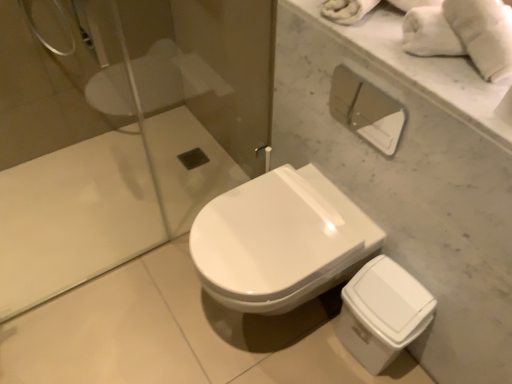
The image size is (512, 384). What do you see at coordinates (366, 110) in the screenshot?
I see `white matte toilet paper at upper right` at bounding box center [366, 110].

This screenshot has height=384, width=512. Describe the element at coordinates (483, 34) in the screenshot. I see `white fluffy towel at upper right` at that location.

Measure the distance between white glossy toilet at center and camera.

white glossy toilet at center is 1.10 meters away from camera.

The image size is (512, 384). Identify the location of white matte toilet paper at upper right. (366, 110).

From a real-world perspective, between white matte toilet paper at upper right and white glossy toilet at center, who is vertically higher?

In real-world perspective, white matte toilet paper at upper right is above.

Who is taller, white matte toilet paper at upper right or white glossy toilet at center?

white glossy toilet at center is taller.

Is white matte toilet paper at upper right looking in the opposite direction of white glossy toilet at center?

white matte toilet paper at upper right is not turned away from white glossy toilet at center.

In the scene shown: From the image's perspective, is white matte toilet paper at upper right on top of white glossy toilet at center?

Yes.

From the image's perspective, is white glossy toilet at center positioned above or below white fluffy towel at upper right?

From the image's perspective, white glossy toilet at center appears below white fluffy towel at upper right.

From a real-world perspective, relative to white fluffy towel at upper right, is white glossy toilet at center vertically above or below?

Clearly, from a real-world perspective, white glossy toilet at center is below white fluffy towel at upper right.

Consider the image. Does white glossy toilet at center have a larger size compared to white matte toilet paper at upper right?

Correct, white glossy toilet at center is larger in size than white matte toilet paper at upper right.

Is point (347, 217) less distant than point (339, 65)?

That is False.

Could you tell me if white glossy toilet at center is turned towards white matte toilet paper at upper right?

No, white glossy toilet at center is not oriented towards white matte toilet paper at upper right.

Is white glossy toilet at center outside of white matte toilet paper at upper right?

white glossy toilet at center is positioned outside white matte toilet paper at upper right.

Considering the sizes of objects white fluffy towel at upper right and white matte toilet paper at upper right in the image provided, who is thinner, white fluffy towel at upper right or white matte toilet paper at upper right?

Thinner between the two is white matte toilet paper at upper right.

Where is `toilet paper on the left of white fluffy towel at upper right`? toilet paper on the left of white fluffy towel at upper right is located at coordinates (366, 110).

Which is correct: white fluffy towel at upper right is inside white matte toilet paper at upper right, or outside of it?

white fluffy towel at upper right is outside white matte toilet paper at upper right.

From a real-world perspective, between white fluffy towel at upper right and white matte toilet paper at upper right, who is vertically higher?

white fluffy towel at upper right, from a real-world perspective.

Does white matte toilet paper at upper right contain white fluffy towel at upper right?

No, white matte toilet paper at upper right does not contain white fluffy towel at upper right.

From a real-world perspective, between white matte toilet paper at upper right and white fluffy towel at upper right, who is vertically higher?

white fluffy towel at upper right is physically above.

Does point (362, 86) come in front of point (500, 37)?

No, (362, 86) is behind (500, 37).

Which of these two, white fluffy towel at upper right or white glossy toilet at center, is wider?

Wider between the two is white glossy toilet at center.

Which of these two, white fluffy towel at upper right or white glossy toilet at center, stands taller?

With more height is white glossy toilet at center.

From a real-world perspective, is white fluffy towel at upper right physically above white glossy toilet at center?

Indeed, from a real-world perspective, white fluffy towel at upper right stands above white glossy toilet at center.

Can you see white fluffy towel at upper right touching white glossy toilet at center?

No, white fluffy towel at upper right is not with white glossy toilet at center.

This screenshot has width=512, height=384. In order to click on toilet paper in front of the white glossy toilet at center in this screenshot , I will do `click(366, 110)`.

Identify the location of toilet beneath the white fluffy towel at upper right (from a real-world perspective). (280, 241).

Which object lies further to the anchor point white glossy toilet at center, white matte toilet paper at upper right or white fluffy towel at upper right?

white matte toilet paper at upper right.

From the image, which object appears to be nearer to white matte toilet paper at upper right, white glossy toilet at center or white fluffy towel at upper right?

The object closer to white matte toilet paper at upper right is white glossy toilet at center.

Estimate the real-world distances between objects in this image. Which object is closer to white glossy toilet at center, white fluffy towel at upper right or white matte toilet paper at upper right?

white fluffy towel at upper right is closer to white glossy toilet at center.

Which object lies further to the anchor point white fluffy towel at upper right, white matte toilet paper at upper right or white glossy toilet at center?

Based on the image, white matte toilet paper at upper right appears to be further to white fluffy towel at upper right.

Estimate the real-world distances between objects in this image. Which object is closer to white matte toilet paper at upper right, white fluffy towel at upper right or white glossy toilet at center?

The object closer to white matte toilet paper at upper right is white glossy toilet at center.

Based on their spatial positions, is white glossy toilet at center or white matte toilet paper at upper right closer to white fluffy towel at upper right?

white glossy toilet at center is closer to white fluffy towel at upper right.

At what (x,y) coordinates should I click in order to perform the action: click on toilet paper that lies between white fluffy towel at upper right and white glossy toilet at center from top to bottom. Please return your answer as a coordinate pair (x, y). Looking at the image, I should click on (366, 110).